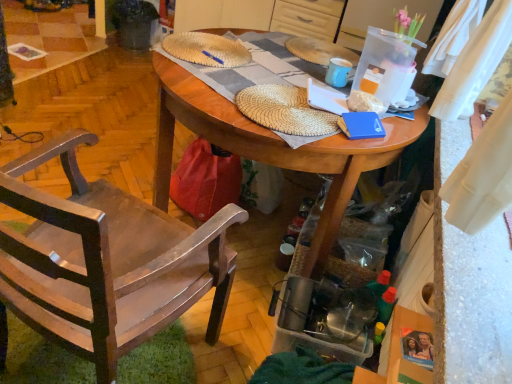
The height and width of the screenshot is (384, 512). In order to click on vacant area that lies between blue matte book at center and woven straw hat at upper center, which is the 2th hat in bottom-to-top order in this screenshot , I will do `click(263, 77)`.